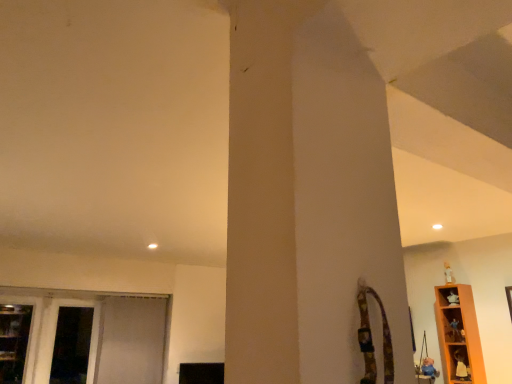
Question: Is wooden shelf at lower right, which is the 2th shelf in top-to-bottom order, located outside white fabric screen door at left, which is the 1th screen door in left-to-right order?

Choices:
 (A) yes
 (B) no

Answer: (A)

Question: Does wooden shelf at lower right, which is the 2th shelf in top-to-bottom order, have a lesser height compared to white fabric screen door at left, the second screen door in the right-to-left sequence?

Choices:
 (A) no
 (B) yes

Answer: (B)

Question: Is wooden shelf at lower right, which is the 2th shelf in top-to-bottom order, oriented towards white fabric screen door at left, which is the 1th screen door in left-to-right order?

Choices:
 (A) no
 (B) yes

Answer: (A)

Question: From a real-world perspective, does wooden shelf at lower right, which is the first shelf from bottom to top, stand above white fabric screen door at left, which is the 1th screen door in left-to-right order?

Choices:
 (A) yes
 (B) no

Answer: (B)

Question: Is the depth of wooden shelf at lower right, which is the first shelf from bottom to top, greater than that of white fabric screen door at left, which is the 1th screen door in left-to-right order?

Choices:
 (A) yes
 (B) no

Answer: (B)

Question: Based on their positions, is orange wood shelf at right, the 1th shelf positioned from the top, located to the left or right of white fabric screen door at left, which is the 1th screen door in left-to-right order?

Choices:
 (A) right
 (B) left

Answer: (A)

Question: In terms of height, does orange wood shelf at right, the 1th shelf positioned from the top, look taller or shorter compared to white fabric screen door at left, the second screen door in the right-to-left sequence?

Choices:
 (A) short
 (B) tall

Answer: (A)

Question: Is point (454, 357) closer or farther from the camera than point (75, 365)?

Choices:
 (A) closer
 (B) farther

Answer: (A)

Question: In terms of width, does orange wood shelf at right, the 2th shelf from the bottom, look wider or thinner when compared to white fabric screen door at left, the second screen door in the right-to-left sequence?

Choices:
 (A) wide
 (B) thin

Answer: (A)

Question: Choose the correct answer: Is wooden shelf at lower right, which is the first shelf from bottom to top, inside white fabric screen door at lower left, positioned as the second screen door in left-to-right order, or outside it?

Choices:
 (A) outside
 (B) inside

Answer: (A)

Question: Looking at the image, does wooden shelf at lower right, which is the 2th shelf in top-to-bottom order, seem bigger or smaller compared to white fabric screen door at lower left, the first screen door when ordered from right to left?

Choices:
 (A) small
 (B) big

Answer: (A)

Question: Is wooden shelf at lower right, which is the 2th shelf in top-to-bottom order, to the left or to the right of white fabric screen door at lower left, the first screen door when ordered from right to left, in the image?

Choices:
 (A) left
 (B) right

Answer: (B)

Question: In terms of width, does wooden shelf at lower right, which is the first shelf from bottom to top, look wider or thinner when compared to white fabric screen door at lower left, the first screen door when ordered from right to left?

Choices:
 (A) thin
 (B) wide

Answer: (A)

Question: Which is correct: white fabric screen door at lower left, the first screen door when ordered from right to left, is inside wooden shelf at lower right, which is the first shelf from bottom to top, or outside of it?

Choices:
 (A) inside
 (B) outside

Answer: (B)

Question: From the image's perspective, is white fabric screen door at lower left, the first screen door when ordered from right to left, located above or below wooden shelf at lower right, which is the first shelf from bottom to top?

Choices:
 (A) below
 (B) above

Answer: (A)